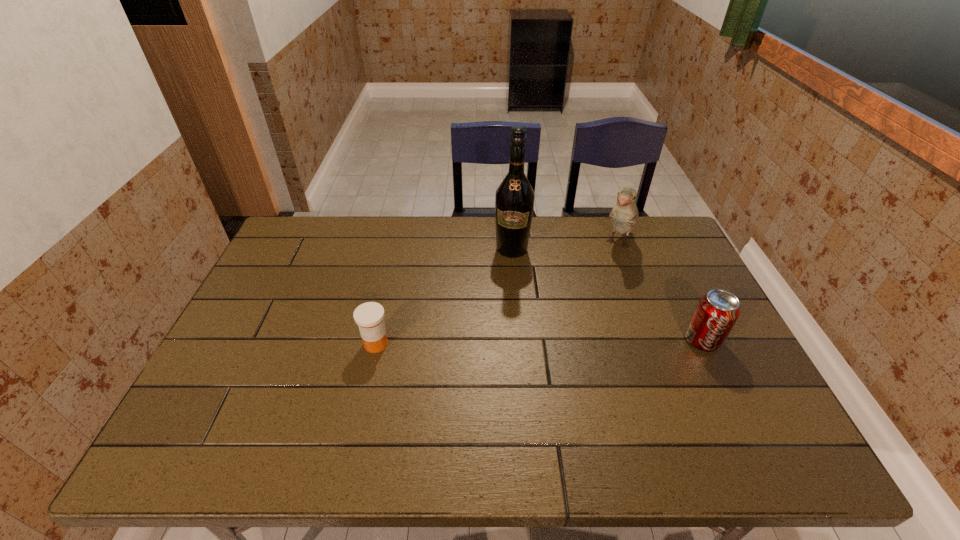
Locate an element on the screen. vacant region located at the face of the second tallest object is located at coordinates (572, 337).

Find the location of a particular element. The image size is (960, 540). vacant space located 0.360m at the face of the second tallest object is located at coordinates (575, 332).

The height and width of the screenshot is (540, 960). I want to click on vacant region located 0.130m at the face of the second tallest object, so click(602, 282).

Where is `vacant space situated on the label of the tallest object`? The image size is (960, 540). vacant space situated on the label of the tallest object is located at coordinates (502, 340).

This screenshot has width=960, height=540. I want to click on vacant space situated 0.240m on the label of the tallest object, so click(504, 315).

Find the location of `vacant region located 0.130m on the label of the tallest object`. vacant region located 0.130m on the label of the tallest object is located at coordinates (508, 288).

Find the location of a particular element. The image size is (960, 540). bird that is positioned at the far edge is located at coordinates (624, 215).

Identify the location of wine bottle that is at the far edge. (514, 201).

Find the location of a particular element. The width and height of the screenshot is (960, 540). soda can located in the right edge section of the desktop is located at coordinates (717, 311).

The width and height of the screenshot is (960, 540). What are the coordinates of `bird that is at the right edge` in the screenshot? It's located at (624, 215).